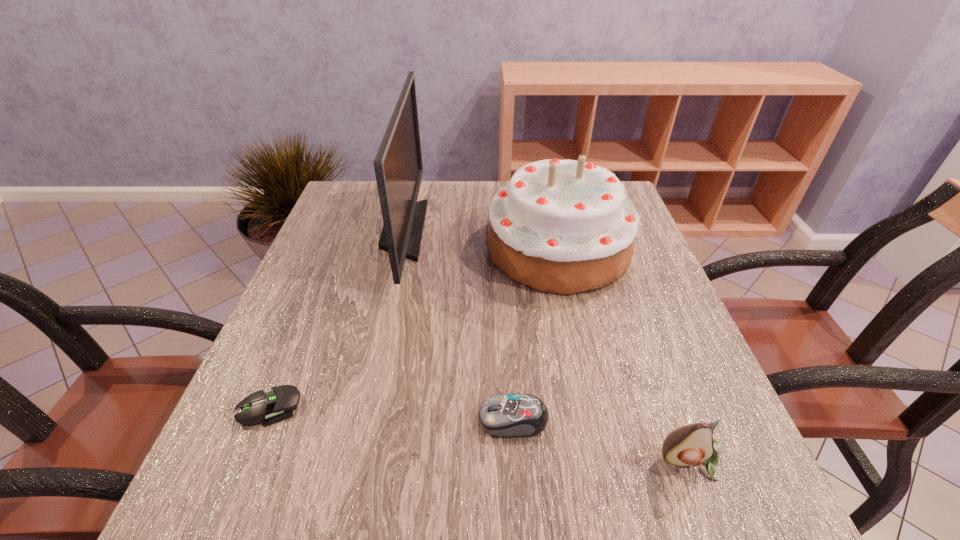
In the image, there is a desktop. At what (x,y) coordinates should I click in order to perform the action: click on vacant space at the near left corner. Please return your answer as a coordinate pair (x, y). The width and height of the screenshot is (960, 540). Looking at the image, I should click on (284, 512).

Where is `free space between the shortest object and the avocado`? Image resolution: width=960 pixels, height=540 pixels. free space between the shortest object and the avocado is located at coordinates (481, 434).

This screenshot has width=960, height=540. What are the coordinates of `vacant area that lies between the cake and the leftmost object` in the screenshot? It's located at (414, 327).

What are the coordinates of `vacant area that lies between the second shortest object and the cake` in the screenshot? It's located at click(x=536, y=334).

The image size is (960, 540). In order to click on unoccupied area between the shorter computer mouse and the nearest object in this screenshot , I will do `click(481, 434)`.

I want to click on free space between the cake and the avocado, so click(x=625, y=355).

I want to click on free point between the fourth tallest object and the avocado, so click(x=603, y=441).

You are a GUI agent. You are given a task and a screenshot of the screen. Output one action in this format:
    pyautogui.click(x=<x>, y=<y>)
    Task: Click on the free space that is in between the second shortest object and the leftmost object
    Image resolution: width=960 pixels, height=540 pixels.
    Given the screenshot: What is the action you would take?
    pyautogui.click(x=392, y=413)

Identify the location of empty location between the leftmost object and the fourth shortest object. The image size is (960, 540). (414, 327).

Locate an element on the screen. Image resolution: width=960 pixels, height=540 pixels. free spot between the third shortest object and the monitor is located at coordinates (548, 346).